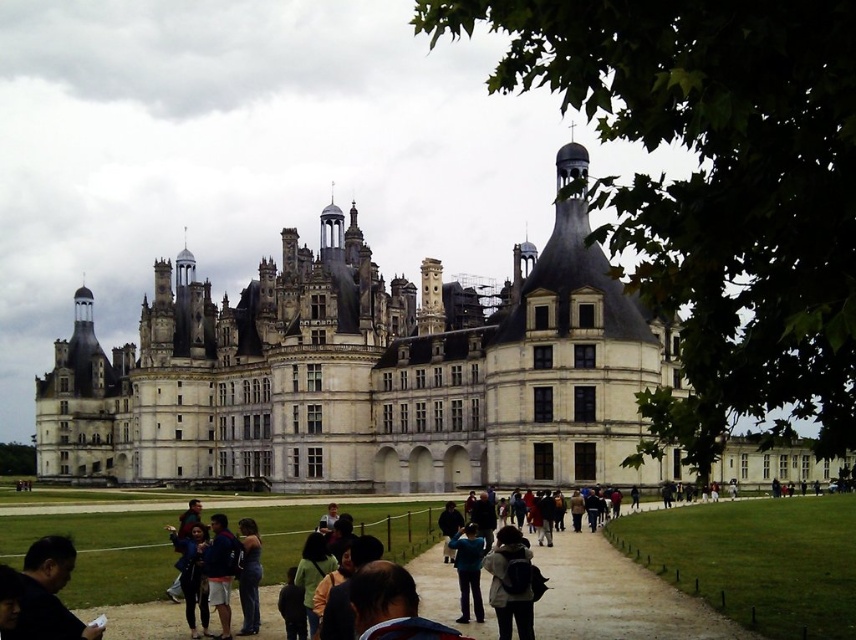
Which of these two, dark blue jacket at center or green fabric jacket at lower center, stands taller?

dark blue jacket at center is taller.

This screenshot has width=856, height=640. Identify the location of dark blue jacket at center. (220, 570).

Image resolution: width=856 pixels, height=640 pixels. Find the location of `dark blue jacket at center`. dark blue jacket at center is located at coordinates (220, 570).

Between white stone castle at center and dark gray backpack at center, which one is positioned lower?

Positioned lower is dark gray backpack at center.

Who is higher up, white stone castle at center or dark gray backpack at center?

white stone castle at center is higher up.

The width and height of the screenshot is (856, 640). In order to click on white stone castle at center in this screenshot , I will do `click(364, 376)`.

Who is higher up, denim jacket at lower left or green fabric jacket at lower center?

green fabric jacket at lower center

Is denim jacket at lower left shorter than green fabric jacket at lower center?

Incorrect, denim jacket at lower left's height does not fall short of green fabric jacket at lower center's.

Which is behind, point (256, 602) or point (304, 602)?

The point (256, 602) is more distant.

The image size is (856, 640). I want to click on denim jacket at lower left, so click(248, 577).